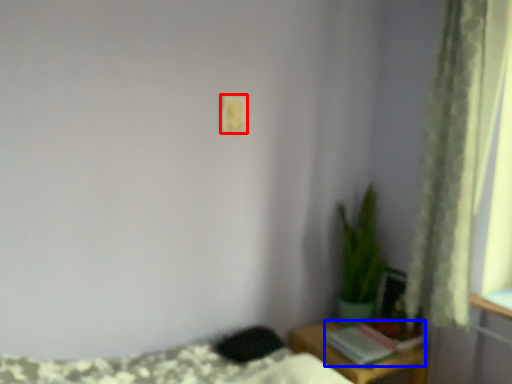
Question: Which object appears closest to the camera in this image, light switch (highlighted by a red box) or book (highlighted by a blue box)?

Choices:
 (A) light switch
 (B) book

Answer: (A)